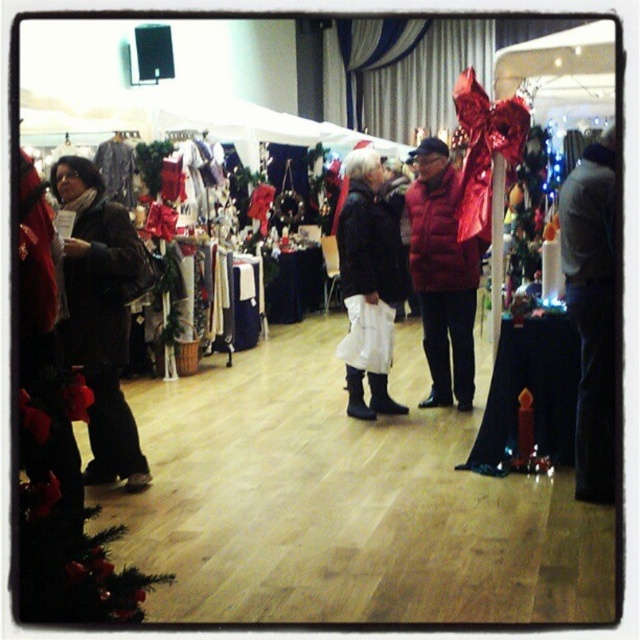
Is matte black jacket at left thinner than matte black boots at center?

Yes, matte black jacket at left is thinner than matte black boots at center.

Between matte black jacket at left and matte black boots at center, which one is positioned lower?

matte black jacket at left

Does point (81, 307) come closer to viewer compared to point (362, 275)?

Yes, it is.

In order to click on matte black jacket at left in this screenshot , I will do `click(99, 316)`.

Between matte black jacket at left and red down jacket at center, which one is positioned lower?

matte black jacket at left is lower down.

Is point (72, 332) in front of point (456, 346)?

That is True.

Image resolution: width=640 pixels, height=640 pixels. I want to click on matte black jacket at left, so pos(99,316).

Is red down jacket at center smaller than matte black boots at center?

No.

Can you confirm if red down jacket at center is positioned to the left of matte black boots at center?

No, red down jacket at center is not to the left of matte black boots at center.

The width and height of the screenshot is (640, 640). I want to click on red down jacket at center, so click(x=442, y=275).

This screenshot has width=640, height=640. I want to click on red down jacket at center, so click(442, 275).